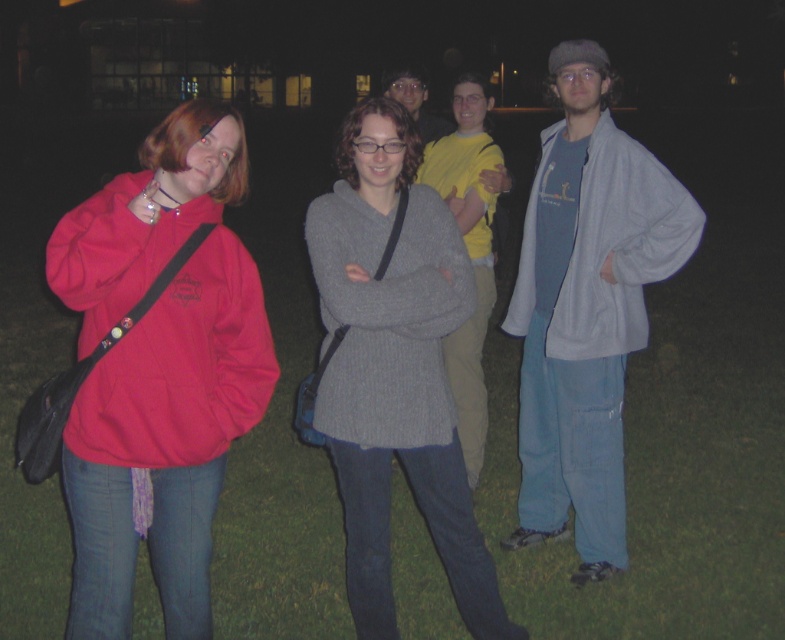
Question: In this image, where is matte red hoodie at left located relative to light blue fleece jacket at right?

Choices:
 (A) below
 (B) above

Answer: (A)

Question: Which object is the farthest from the yellow cotton shirt at center?

Choices:
 (A) light blue fleece jacket at right
 (B) knitted gray sweater at center

Answer: (B)

Question: Which point is closer to the camera?

Choices:
 (A) (689, 234)
 (B) (420, 138)
 (C) (367, 474)

Answer: (C)

Question: Which of these objects is positioned closest to the matte red hoodie at left?

Choices:
 (A) knitted gray sweater at center
 (B) yellow cotton shirt at center
 (C) matte gray sweater at center
 (D) light blue fleece jacket at right

Answer: (A)

Question: Is knitted gray sweater at center positioned in front of yellow cotton shirt at center?

Choices:
 (A) no
 (B) yes

Answer: (B)

Question: Is the position of knitted gray sweater at center less distant than that of yellow cotton shirt at center?

Choices:
 (A) no
 (B) yes

Answer: (B)